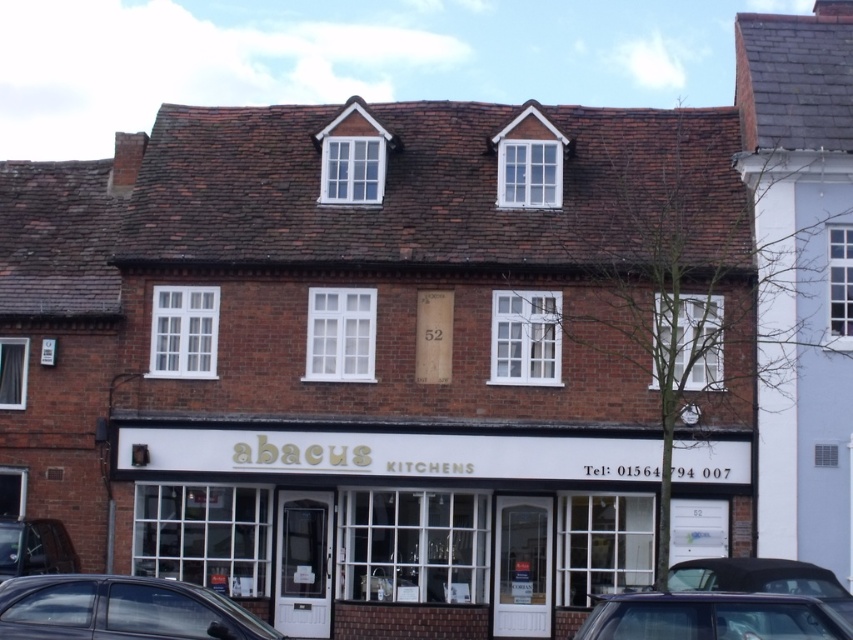
Question: Where is white wooden storefront at center located in relation to metallic gray car at lower center in the image?

Choices:
 (A) right
 (B) left

Answer: (B)

Question: Considering the real-world distances, which object is closest to the metallic silver car at lower left?

Choices:
 (A) metallic gray car at lower center
 (B) white wooden storefront at center
 (C) dark gray metallic car at lower left

Answer: (B)

Question: Can you confirm if white wooden storefront at center is positioned to the left of metallic gray car at lower center?

Choices:
 (A) yes
 (B) no

Answer: (A)

Question: Estimate the real-world distances between objects in this image. Which object is closer to the dark gray metallic car at lower left?

Choices:
 (A) metallic gray car at lower center
 (B) white wooden storefront at center
 (C) metallic silver car at lower left

Answer: (A)

Question: Does dark gray metallic car at lower left lie in front of metallic silver car at lower left?

Choices:
 (A) yes
 (B) no

Answer: (A)

Question: Considering the real-world distances, which object is closest to the metallic silver car at lower left?

Choices:
 (A) metallic gray car at lower center
 (B) dark gray metallic car at lower left

Answer: (B)